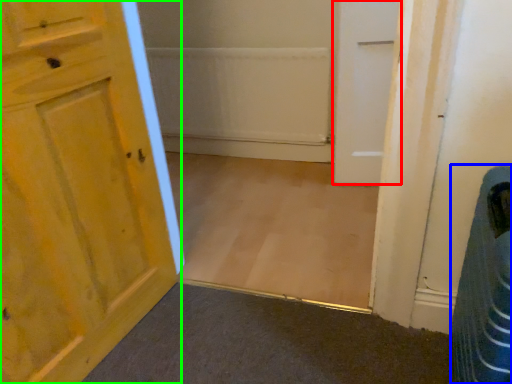
Question: Estimate the real-world distances between objects in this image. Which object is closer to door (highlighted by a red box), laundry basket (highlighted by a blue box) or door (highlighted by a green box)?

Choices:
 (A) laundry basket
 (B) door

Answer: (A)